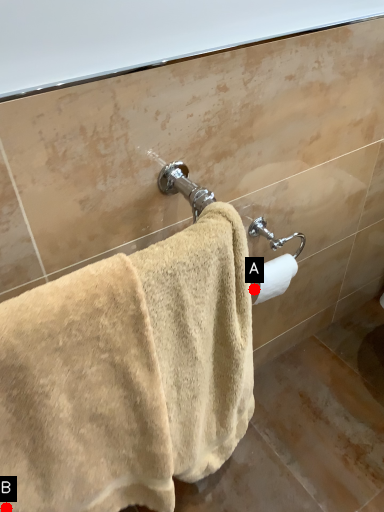
Question: Two points are circled on the image, labeled by A and B beside each circle. Which of the following is the farthest from the observer?

Choices:
 (A) A is further
 (B) B is further

Answer: (A)